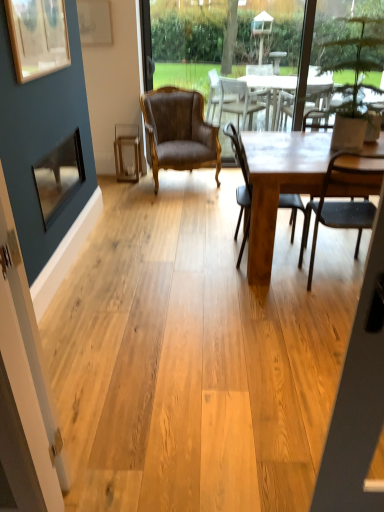
This screenshot has height=512, width=384. Identify the location of free spot to the left of matte brown chair at center, which is the 2th chair from right to left. (x=190, y=254).